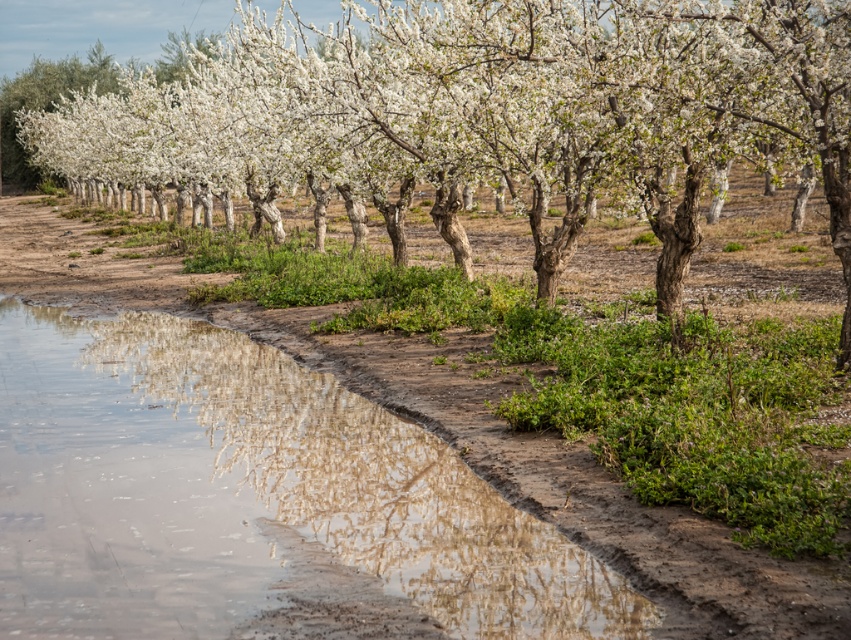
Question: Which point is farther to the camera?

Choices:
 (A) (267, 76)
 (B) (78, 570)

Answer: (A)

Question: Observing the image, what is the correct spatial positioning of muddy water at lower left in reference to white blossoming tree at center?

Choices:
 (A) above
 (B) below

Answer: (B)

Question: Observing the image, what is the correct spatial positioning of muddy water at lower left in reference to white blossoming tree at center?

Choices:
 (A) left
 (B) right

Answer: (B)

Question: Does muddy water at lower left appear over white blossoming tree at center?

Choices:
 (A) no
 (B) yes

Answer: (A)